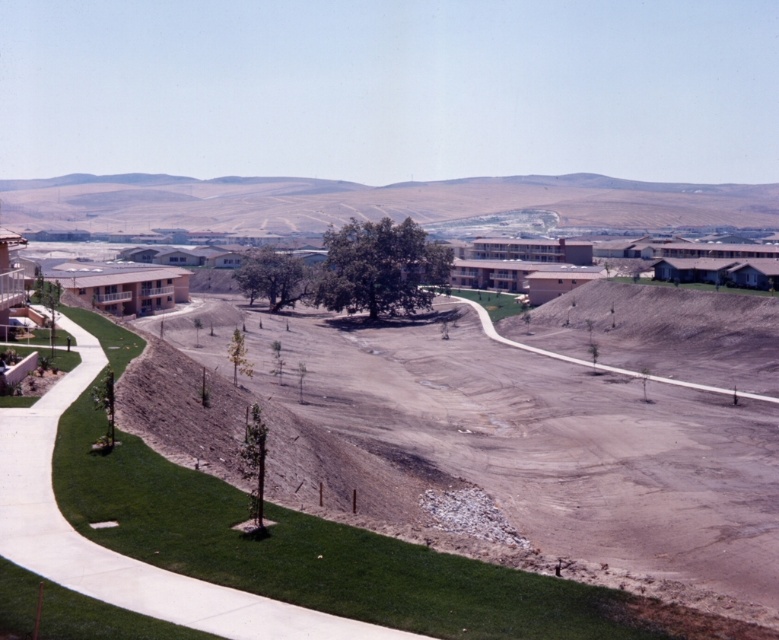
Question: Which of the following is the closest to the observer?

Choices:
 (A) brown dirt hillside at center
 (B) dull brown dirt field at center

Answer: (B)

Question: Is dull brown dirt field at center to the left of green concrete sidewalk at center from the viewer's perspective?

Choices:
 (A) no
 (B) yes

Answer: (A)

Question: Observing the image, what is the correct spatial positioning of green concrete sidewalk at center in reference to dirt/gravel path at center?

Choices:
 (A) above
 (B) below

Answer: (B)

Question: Where is dull brown dirt field at center located in relation to brown dirt hillside at center in the image?

Choices:
 (A) right
 (B) left

Answer: (A)

Question: Which point is closer to the camera?

Choices:
 (A) (344, 186)
 (B) (516, 516)
 (C) (644, 372)
 (D) (369, 627)

Answer: (D)

Question: Estimate the real-world distances between objects in this image. Which object is farther from the brown dirt hillside at center?

Choices:
 (A) dirt/gravel path at center
 (B) dull brown dirt field at center

Answer: (B)